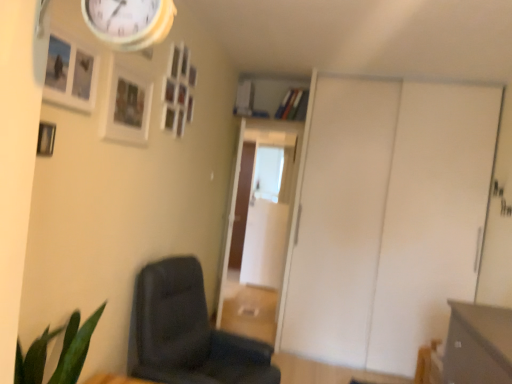
Question: Which direction should I rotate to face transparent glass door at center, which is counted as the 2th glass door, starting from the front, — up or down?

Choices:
 (A) up
 (B) down

Answer: (B)

Question: Can you confirm if dark gray fabric chair at lower left is thinner than matte gray drawer at lower right?

Choices:
 (A) yes
 (B) no

Answer: (B)

Question: Is dark gray fabric chair at lower left positioned with its back to matte gray drawer at lower right?

Choices:
 (A) yes
 (B) no

Answer: (B)

Question: Is dark gray fabric chair at lower left placed right next to matte gray drawer at lower right?

Choices:
 (A) yes
 (B) no

Answer: (B)

Question: Does dark gray fabric chair at lower left have a greater width compared to matte gray drawer at lower right?

Choices:
 (A) no
 (B) yes

Answer: (B)

Question: Considering the relative sizes of dark gray fabric chair at lower left and matte gray drawer at lower right in the image provided, is dark gray fabric chair at lower left smaller than matte gray drawer at lower right?

Choices:
 (A) yes
 (B) no

Answer: (B)

Question: Considering the relative positions of dark gray fabric chair at lower left and matte gray drawer at lower right in the image provided, is dark gray fabric chair at lower left to the right of matte gray drawer at lower right from the viewer's perspective?

Choices:
 (A) no
 (B) yes

Answer: (A)

Question: Is dark gray fabric chair at lower left shorter than wooden photo frame at upper center, positioned as the fourth picture frame in front-to-back order?

Choices:
 (A) no
 (B) yes

Answer: (A)

Question: Considering the relative sizes of dark gray fabric chair at lower left and wooden photo frame at upper center, positioned as the fourth picture frame in front-to-back order, in the image provided, is dark gray fabric chair at lower left smaller than wooden photo frame at upper center, positioned as the fourth picture frame in front-to-back order,?

Choices:
 (A) yes
 (B) no

Answer: (B)

Question: From a real-world perspective, is dark gray fabric chair at lower left located beneath wooden photo frame at upper center, positioned as the fourth picture frame in front-to-back order?

Choices:
 (A) yes
 (B) no

Answer: (A)

Question: Is dark gray fabric chair at lower left closer to the viewer compared to wooden photo frame at upper center, positioned as the fourth picture frame in front-to-back order?

Choices:
 (A) no
 (B) yes

Answer: (B)

Question: Is dark gray fabric chair at lower left at the left side of wooden photo frame at upper center, acting as the 1th picture frame starting from the back?

Choices:
 (A) yes
 (B) no

Answer: (B)

Question: Is dark gray fabric chair at lower left bigger than wooden photo frame at upper center, positioned as the fourth picture frame in front-to-back order?

Choices:
 (A) no
 (B) yes

Answer: (B)

Question: Is white matte sliding door at right further to the viewer compared to matte gray drawer at lower right?

Choices:
 (A) yes
 (B) no

Answer: (A)